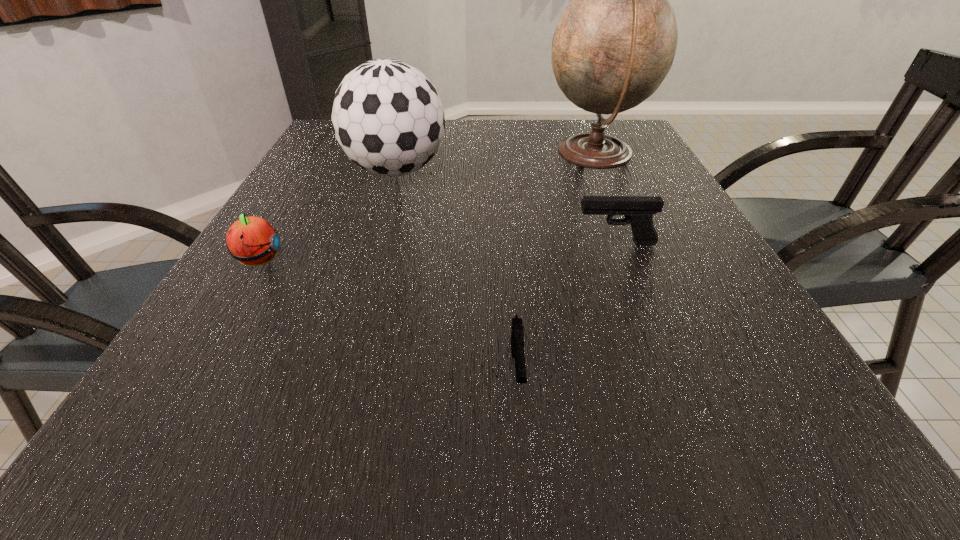
At what (x,y) coordinates should I click in order to perform the action: click on globe. Please return your answer as a coordinate pair (x, y). The width and height of the screenshot is (960, 540). Looking at the image, I should click on (615, 43).

The image size is (960, 540). I want to click on the fourth shortest object, so click(387, 116).

Identify the location of soccer ball. (387, 116).

You are a GUI agent. You are given a task and a screenshot of the screen. Output one action in this format:
    pyautogui.click(x=<x>, y=<y>)
    Task: Click on the taller pistol
    The width and height of the screenshot is (960, 540).
    Given the screenshot: What is the action you would take?
    pyautogui.click(x=638, y=211)

Image resolution: width=960 pixels, height=540 pixels. I want to click on the right pistol, so click(x=638, y=211).

I want to click on the leftmost object, so click(x=251, y=240).

Identify the location of the shortest object. The width and height of the screenshot is (960, 540). (517, 338).

Locate an element on the screen. the nearer pistol is located at coordinates (517, 338).

Identify the location of blank area located on the front-facing side of the tallest object. The height and width of the screenshot is (540, 960). (523, 156).

Where is `vacant space located 0.350m on the front-facing side of the tallest object`? This screenshot has height=540, width=960. vacant space located 0.350m on the front-facing side of the tallest object is located at coordinates (411, 156).